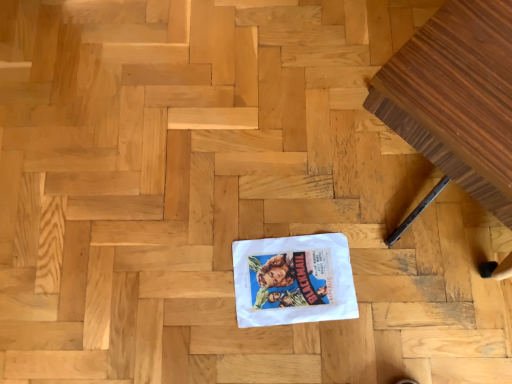
Where is `vacant space positioned to the left of wooden piano at right`? The width and height of the screenshot is (512, 384). vacant space positioned to the left of wooden piano at right is located at coordinates (234, 171).